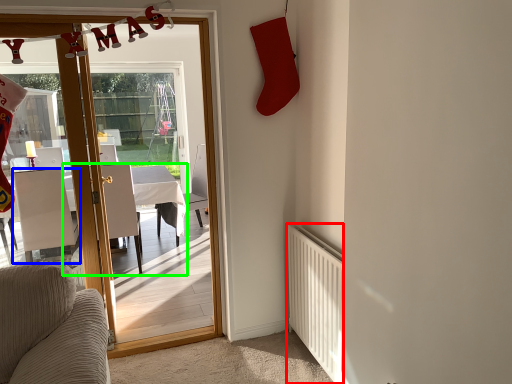
Question: Which object is positioned farthest from radiator (highlighted by a red box)? Select from chair (highlighted by a blue box) and table (highlighted by a green box).

Choices:
 (A) chair
 (B) table

Answer: (A)